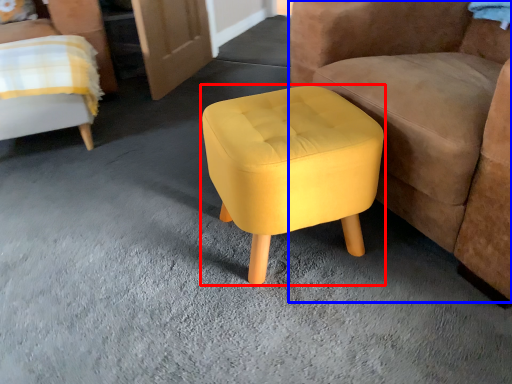
Question: Which object is further to the camera taking this photo, stool (highlighted by a red box) or chair (highlighted by a blue box)?

Choices:
 (A) stool
 (B) chair

Answer: (A)